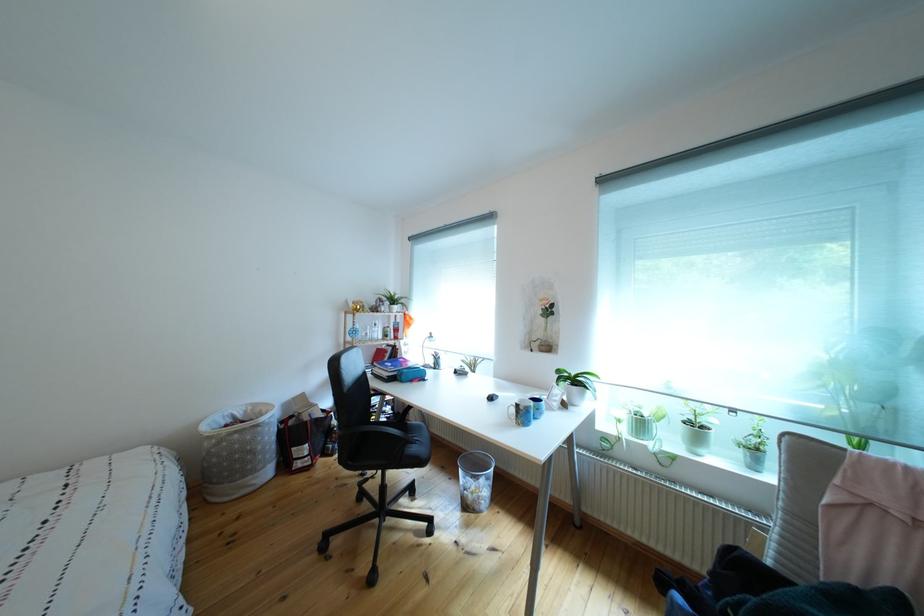
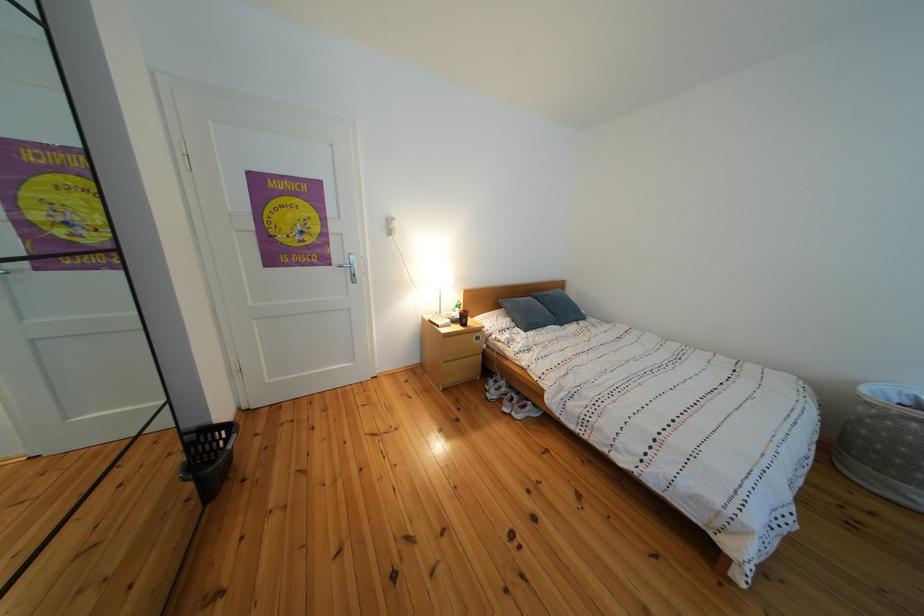
Question: How did the camera likely rotate?

Choices:
 (A) Left
 (B) Right
 (C) Up
 (D) Down

Answer: (A)